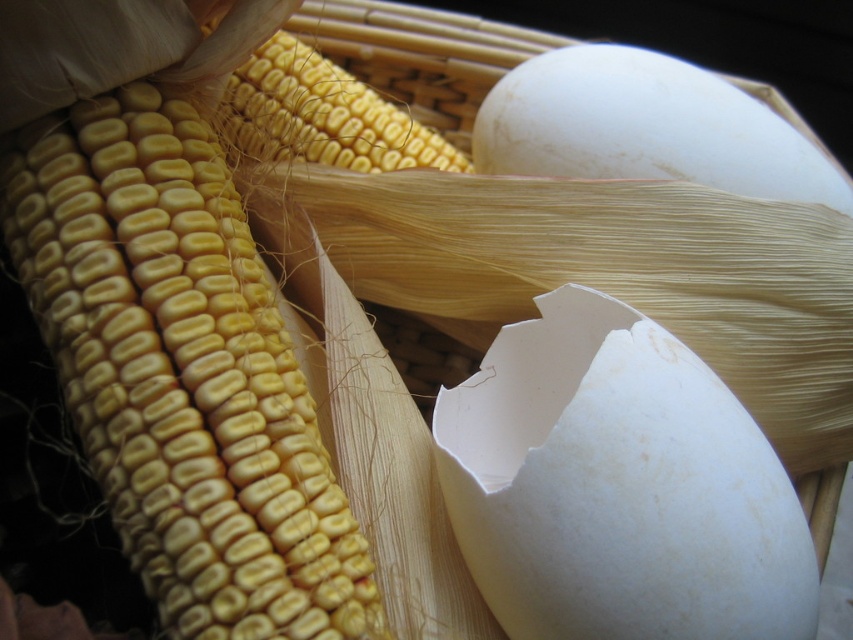
You are a chef preparing a dish and need to know which item is wider between the white smooth egg at center and the yellow matte corn at upper left. Based on the scene, can you determine which one is wider?

The white smooth egg at center might be wider than yellow matte corn at upper left according to the description.

You are a chef holding a knife and standing 20 inches away from the yellow matte corn at left. Can you reach it without moving closer?

The yellow matte corn at left is 21.20 inches away from the camera. Since you are standing 20 inches away, you are closer to the corn than the camera. Therefore, you can reach the yellow matte corn at left without moving closer.